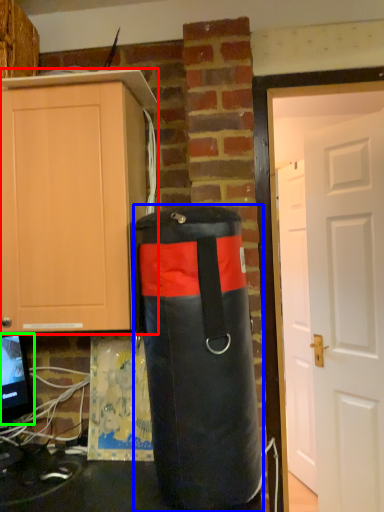
Question: Estimate the real-world distances between objects in this image. Which object is closer to cabinetry (highlighted by a red box), punching bag (highlighted by a blue box) or computer monitor (highlighted by a green box)?

Choices:
 (A) punching bag
 (B) computer monitor

Answer: (A)